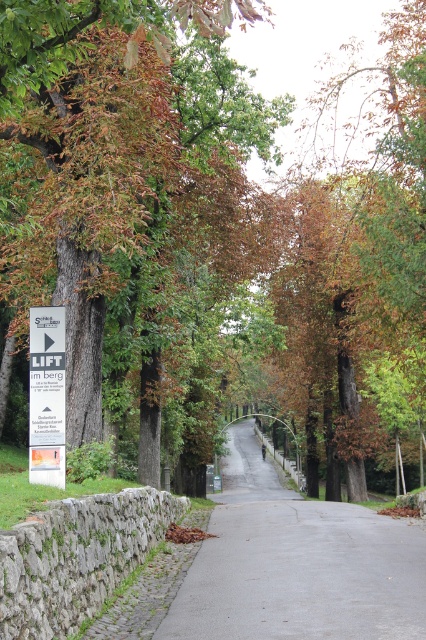
Can you confirm if gray asphalt road at center is thinner than white plastic sign at left?

No.

Is gray asphalt road at center positioned at the back of white plastic sign at left?

No, it is not.

Measure the distance between point [245,584] and camera.

Point [245,584] is 9.22 meters from camera.

Identify the location of gray asphalt road at center. The width and height of the screenshot is (426, 640). (296, 563).